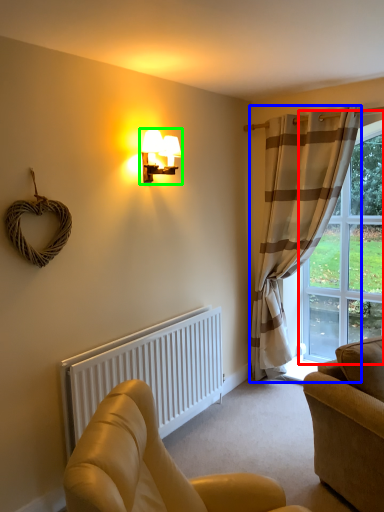
Question: Estimate the real-world distances between objects in this image. Which object is farther from window (highlighted by a red box), curtain (highlighted by a blue box) or lamp (highlighted by a green box)?

Choices:
 (A) curtain
 (B) lamp

Answer: (B)